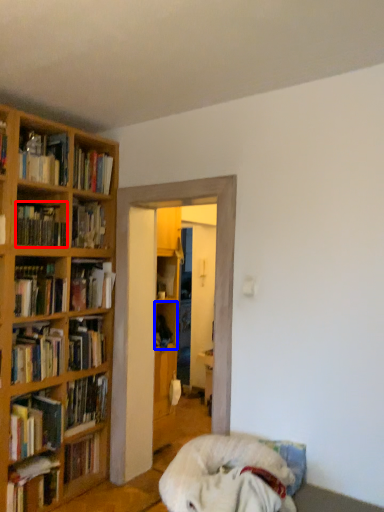
Question: Which object appears closest to the camera in this image, book (highlighted by a red box) or cabinet (highlighted by a blue box)?

Choices:
 (A) book
 (B) cabinet

Answer: (A)